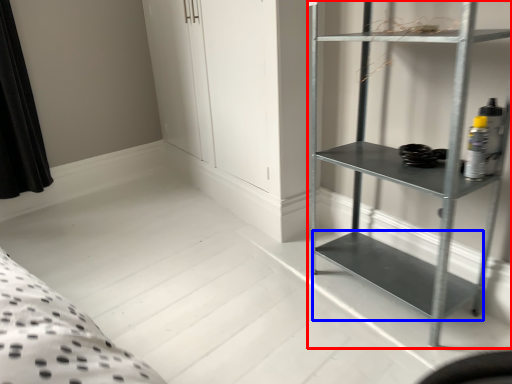
Question: Which of the following is the farthest to the observer, shelf (highlighted by a red box) or cabinet (highlighted by a blue box)?

Choices:
 (A) shelf
 (B) cabinet

Answer: (B)